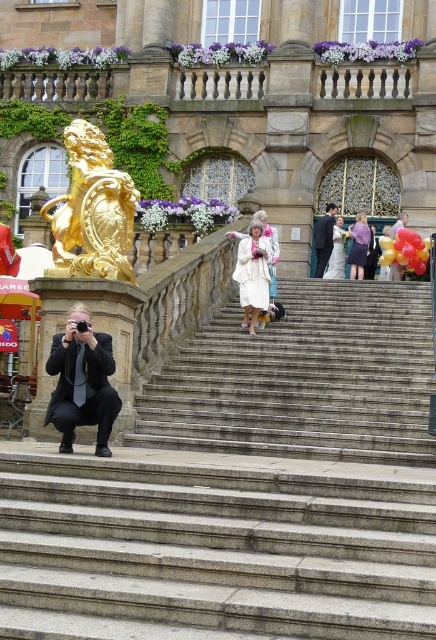
You are standing at the bottom of the stone steps leading to the grand building. You see the gold polished lion at upper center and the white fur coat at center. Which object is closer to your left side?

The gold polished lion at upper center is positioned on the left side of white fur coat at center, so it is closer to your left side.